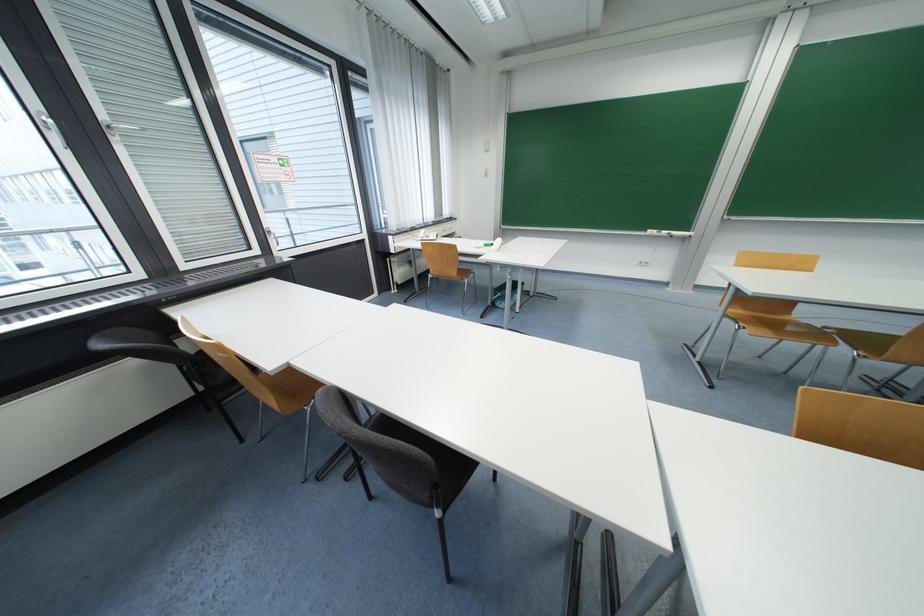
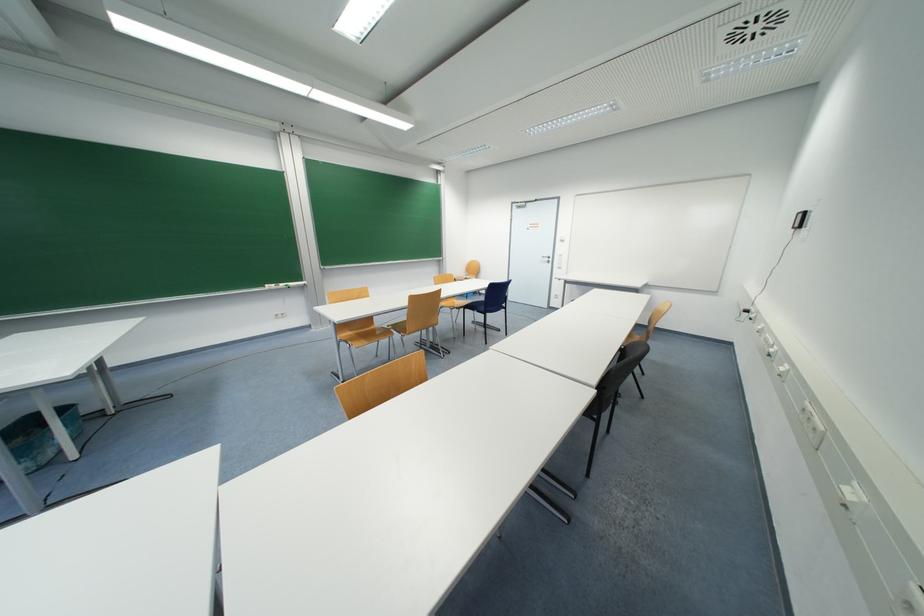
Where in the second image is the point corresponding to (x=871, y=342) from the first image?

(405, 329)